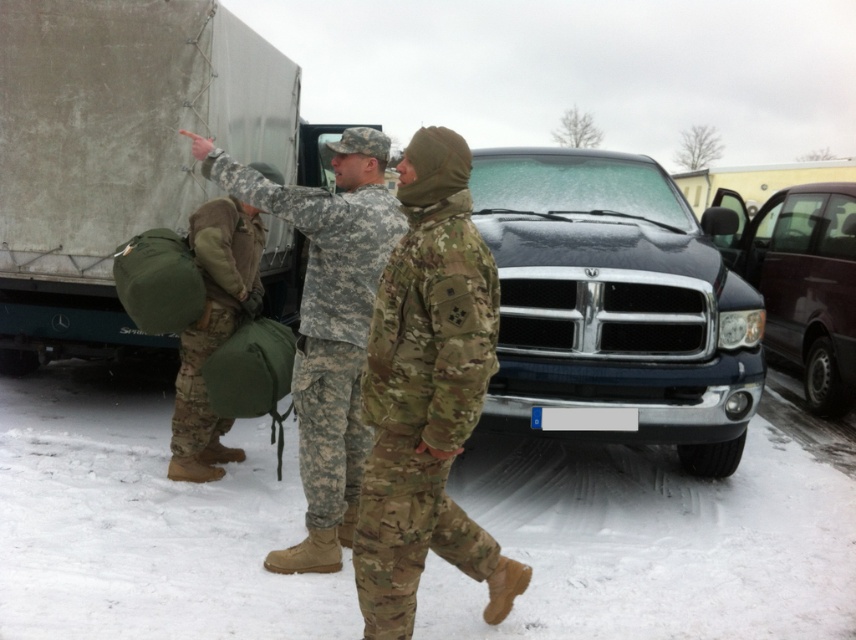
You are a soldier in the scene and need to move quickly across the white powdery snow at lower center and the camouflage fabric backpack at left. Which surface will be harder to walk on?

The camouflage fabric backpack at left will be harder to walk on because it occupies more space than the white powdery snow at lower center, making it less stable underfoot.